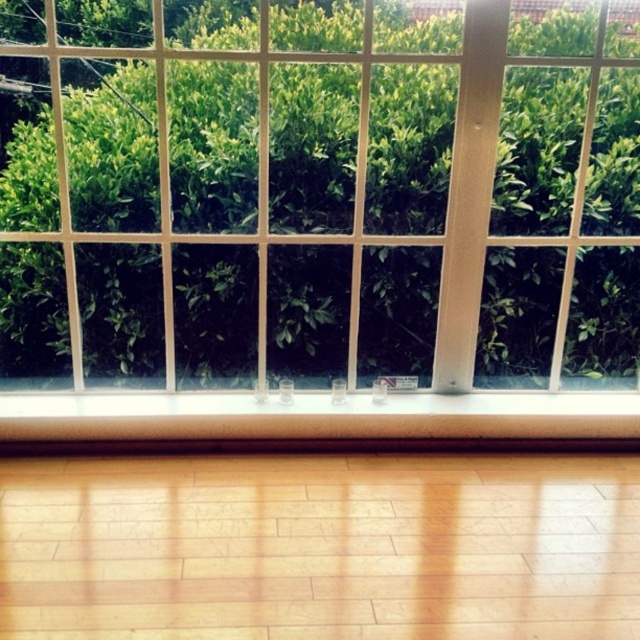
You are standing in the room and want to place a small potted plant on the surface closest to you. Which object should you choose between the clear glass window at center and the wooden at lower center?

The clear glass window at center is closer to the viewer than the wooden at lower center, so you should place the potted plant on the clear glass window at center.

You are standing in the room and want to open the clear glass window at center. Can you reach it without moving your position?

The clear glass window at center is 5.38 feet away from you, so you can reach it without moving your position.

You have a 24 inch long decorative rod that you want to place horizontally between the clear glass window at center and the wooden at lower center. Based on the scene description, will the rod fit without bending or breaking?

The distance between the clear glass window at center and the wooden at lower center is 23.79 inches. Since the rod is 24 inches long, it will not fit as it is slightly longer than the available space. You might need a shorter rod or adjust the placement.